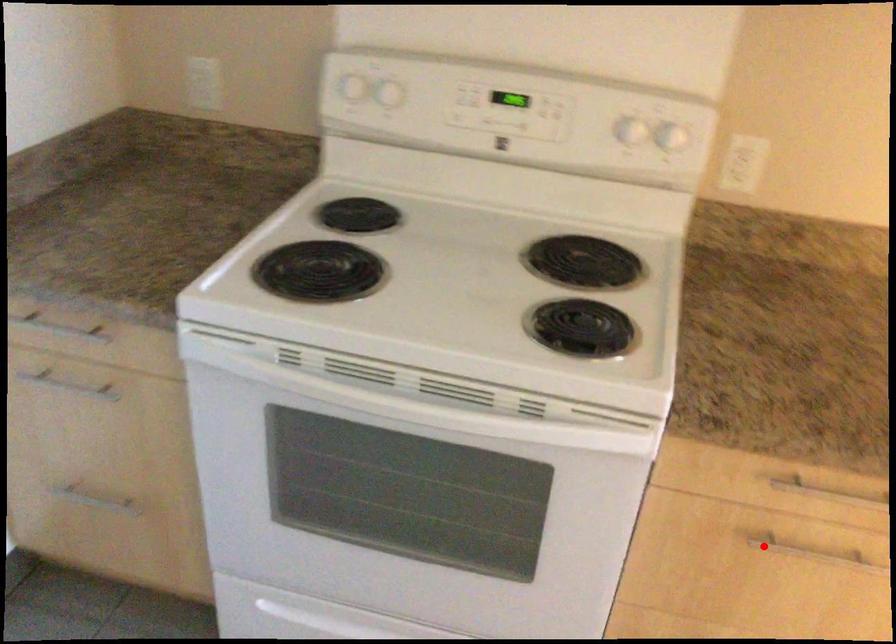
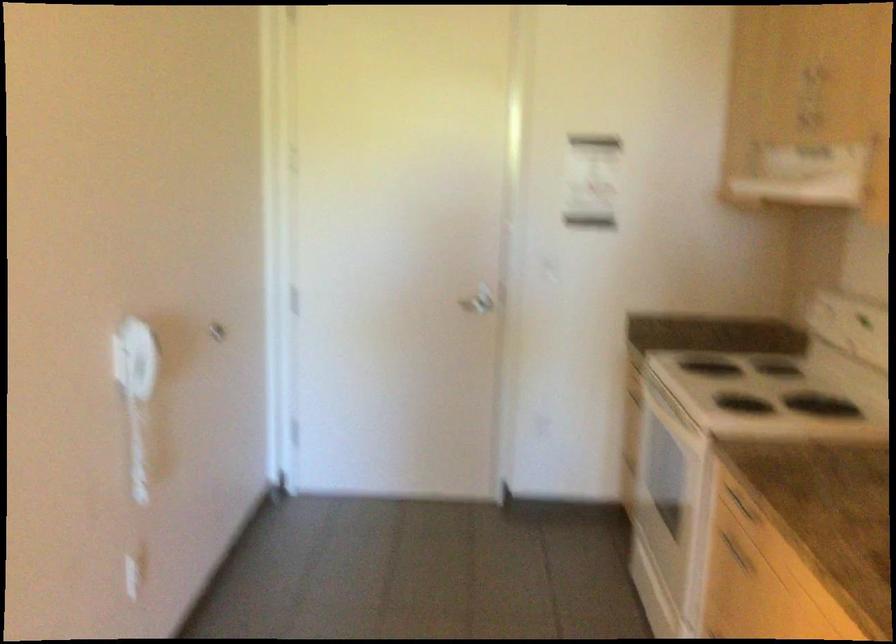
Question: I am providing you with two images of the same scene from different viewpoints. A red point is shown in image1. For the corresponding object point in image2, is it positioned nearer or farther from the camera?

Choices:
 (A) Nearer
 (B) Farther

Answer: (B)